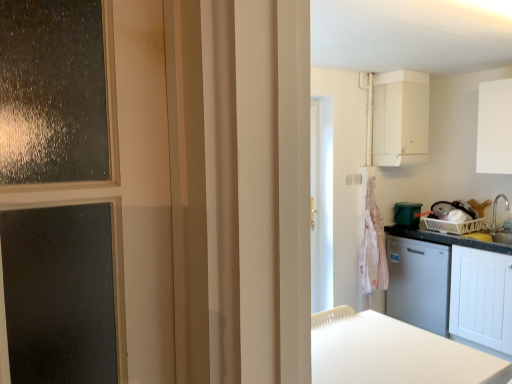
Question: Should I look upward or downward to see white matte table at lower center?

Choices:
 (A) up
 (B) down

Answer: (B)

Question: Is white matte table at lower center to the right of white matte cabinet at upper right, which is the 1th cabinetry in top-to-bottom order, from the viewer's perspective?

Choices:
 (A) no
 (B) yes

Answer: (A)

Question: Is white matte table at lower center behind white matte cabinet at upper right, which is the 1th cabinetry in top-to-bottom order?

Choices:
 (A) yes
 (B) no

Answer: (B)

Question: From the image's perspective, would you say white matte table at lower center is positioned over white matte cabinet at upper right, acting as the 3th cabinetry starting from the bottom?

Choices:
 (A) yes
 (B) no

Answer: (B)

Question: From the image's perspective, does white matte table at lower center appear lower than white matte cabinet at upper right, acting as the 3th cabinetry starting from the bottom?

Choices:
 (A) yes
 (B) no

Answer: (A)

Question: From a real-world perspective, is white matte table at lower center on top of white matte cabinet at upper right, which is the 1th cabinetry in top-to-bottom order?

Choices:
 (A) yes
 (B) no

Answer: (B)

Question: Is there a large distance between white matte table at lower center and white matte cabinet at upper right, which is the 1th cabinetry in top-to-bottom order?

Choices:
 (A) yes
 (B) no

Answer: (A)

Question: Considering the relative positions of white matte cabinet at upper right, which is the 1th cabinetry in top-to-bottom order, and white matte cabinet at right, the 1th cabinetry ordered from the bottom, in the image provided, is white matte cabinet at upper right, which is the 1th cabinetry in top-to-bottom order, in front of white matte cabinet at right, the 1th cabinetry ordered from the bottom,?

Choices:
 (A) no
 (B) yes

Answer: (A)

Question: From a real-world perspective, is white matte cabinet at upper right, acting as the 3th cabinetry starting from the bottom, under white matte cabinet at right, which is the 3th cabinetry in top-to-bottom order?

Choices:
 (A) no
 (B) yes

Answer: (A)

Question: Is white matte cabinet at upper right, which is the 1th cabinetry in top-to-bottom order, facing towards white matte cabinet at right, which is the 3th cabinetry in top-to-bottom order?

Choices:
 (A) no
 (B) yes

Answer: (A)

Question: From a real-world perspective, is white matte cabinet at upper right, acting as the 3th cabinetry starting from the bottom, located higher than white matte cabinet at right, which is the 3th cabinetry in top-to-bottom order?

Choices:
 (A) no
 (B) yes

Answer: (B)

Question: Does white matte cabinet at upper right, which is the 1th cabinetry in top-to-bottom order, have a lesser height compared to white matte cabinet at right, the 1th cabinetry ordered from the bottom?

Choices:
 (A) yes
 (B) no

Answer: (A)

Question: Are white matte cabinet at upper right, which is the 1th cabinetry in top-to-bottom order, and white matte cabinet at right, the 1th cabinetry ordered from the bottom, making contact?

Choices:
 (A) no
 (B) yes

Answer: (A)

Question: Is pink striped fabric at right positioned with its back to white matte cabinet at upper right, acting as the 3th cabinetry starting from the bottom?

Choices:
 (A) no
 (B) yes

Answer: (A)